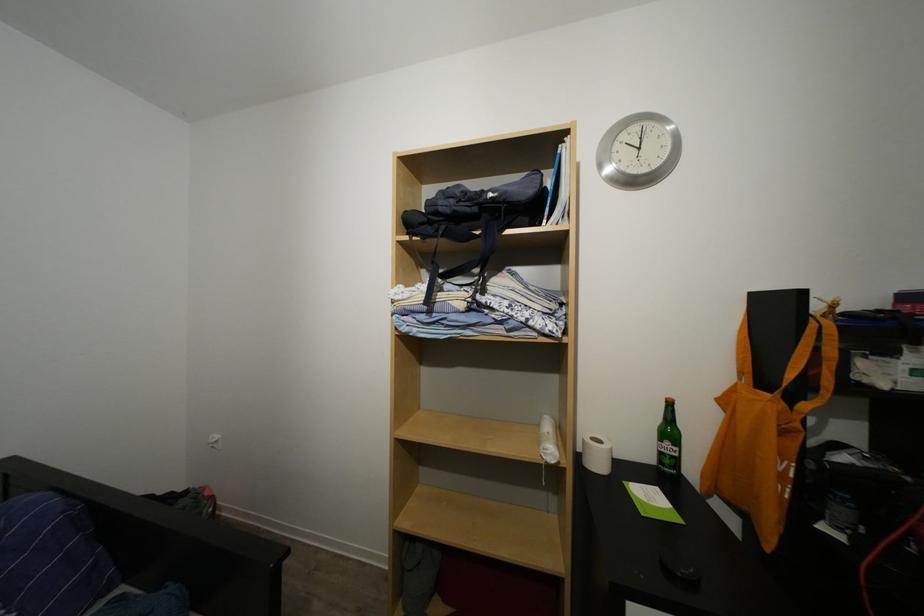
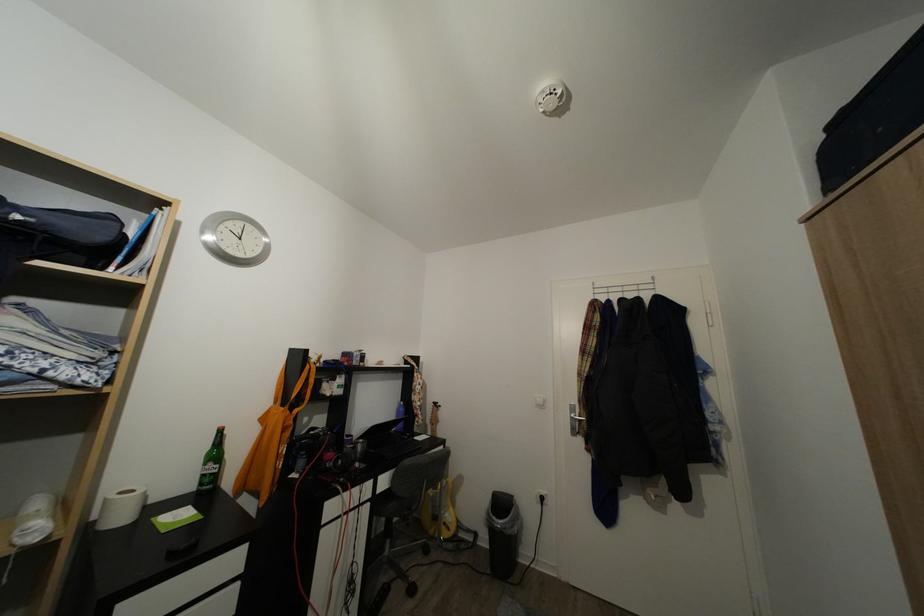
Where in the second image is the point corresponding to pixel 497 201 from the first image?

(25, 223)